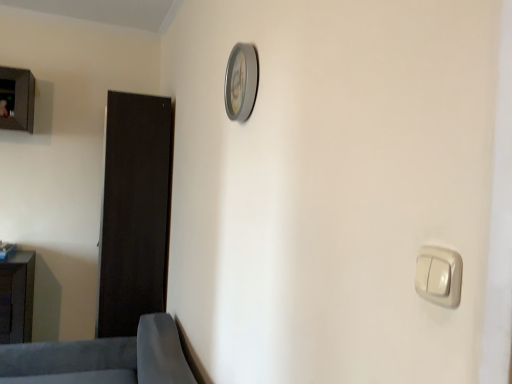
Question: Does soft gray fabric sofa at lower left, which appears as the 2th furniture when viewed from the back, have a lesser width compared to white glossy light switch at lower right?

Choices:
 (A) no
 (B) yes

Answer: (A)

Question: Is soft gray fabric sofa at lower left, which appears as the 2th furniture when viewed from the back, outside white glossy light switch at lower right?

Choices:
 (A) yes
 (B) no

Answer: (A)

Question: Is white glossy light switch at lower right inside soft gray fabric sofa at lower left, the first furniture viewed from the right?

Choices:
 (A) no
 (B) yes

Answer: (A)

Question: Is soft gray fabric sofa at lower left, which ranks as the 1th furniture in front-to-back order, to the left of white glossy light switch at lower right from the viewer's perspective?

Choices:
 (A) no
 (B) yes

Answer: (B)

Question: Is soft gray fabric sofa at lower left, arranged as the second furniture when viewed from the left, directly adjacent to white glossy light switch at lower right?

Choices:
 (A) yes
 (B) no

Answer: (B)

Question: Can you confirm if soft gray fabric sofa at lower left, the first furniture viewed from the right, is shorter than white glossy light switch at lower right?

Choices:
 (A) yes
 (B) no

Answer: (B)

Question: Is soft gray fabric sofa at lower left, which appears as the 2th furniture when viewed from the back, located within matte black cabinet at lower left, acting as the first furniture starting from the back?

Choices:
 (A) yes
 (B) no

Answer: (B)

Question: Is matte black cabinet at lower left, acting as the first furniture starting from the back, facing away from soft gray fabric sofa at lower left, arranged as the second furniture when viewed from the left?

Choices:
 (A) yes
 (B) no

Answer: (B)

Question: Is matte black cabinet at lower left, placed as the first furniture when sorted from left to right, to the left of soft gray fabric sofa at lower left, which appears as the 2th furniture when viewed from the back, from the viewer's perspective?

Choices:
 (A) no
 (B) yes

Answer: (B)

Question: From the image's perspective, is matte black cabinet at lower left, placed as the first furniture when sorted from left to right, beneath soft gray fabric sofa at lower left, arranged as the second furniture when viewed from the left?

Choices:
 (A) yes
 (B) no

Answer: (B)

Question: Is matte black cabinet at lower left, the second furniture when ordered from right to left, in contact with soft gray fabric sofa at lower left, which appears as the 2th furniture when viewed from the back?

Choices:
 (A) no
 (B) yes

Answer: (A)

Question: Can you confirm if matte black cabinet at lower left, the second furniture when ordered from right to left, is taller than soft gray fabric sofa at lower left, arranged as the second furniture when viewed from the left?

Choices:
 (A) no
 (B) yes

Answer: (B)

Question: Is silver metallic clock at upper center oriented away from dark wood door at left?

Choices:
 (A) no
 (B) yes

Answer: (A)